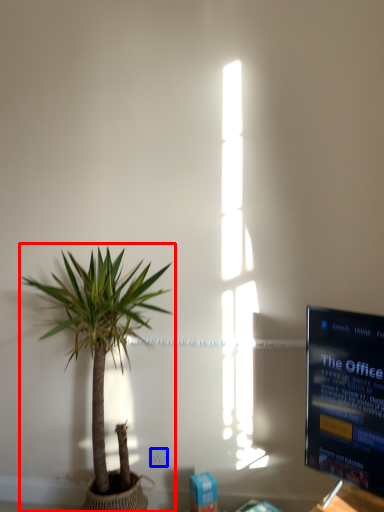
Question: Among these objects, which one is nearest to the camera, houseplant (highlighted by a red box) or electric outlet (highlighted by a blue box)?

Choices:
 (A) houseplant
 (B) electric outlet

Answer: (A)